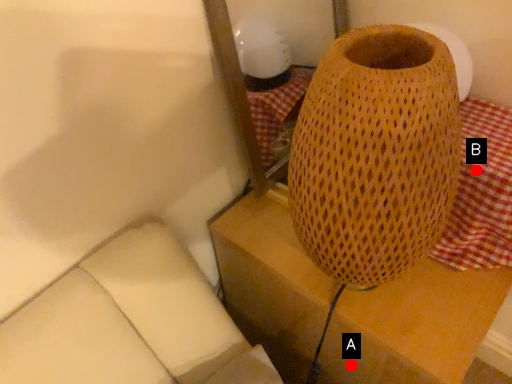
Question: Two points are circled on the image, labeled by A and B beside each circle. Which point appears closest to the camera in this image?

Choices:
 (A) A is closer
 (B) B is closer

Answer: (B)